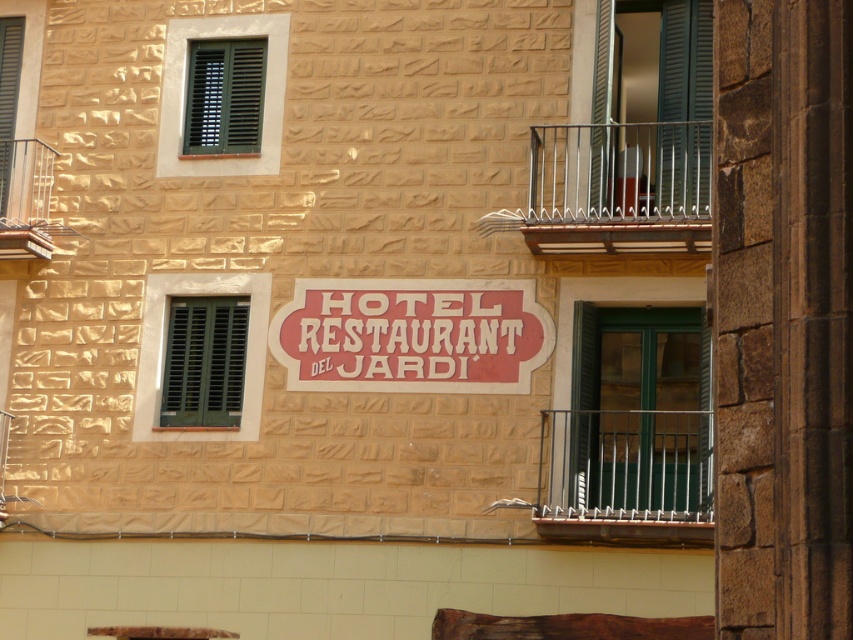
You are standing at a point 101.82 feet away from the point marked at coordinates (682, 129) on the building facade. If you want to take a photo of the rectangular sign with rounded corners that says HOTEL RESTAURANT DEL JARDI, will you be able to capture the entire sign in your shot without moving closer?

The point marked at coordinates (682, 129) is 101.82 feet away from you. Since the rectangular sign with rounded corners is located on the same building facade, its distance from you would also be approximately 101.82 feet. Whether you can capture the entire sign depends on your camera lens and field of view, but the distance alone does not guarantee it. However, based on typical camera capabilities, at this distance, it might be possible to frame the sign properly without moving closer, assuming the sign

You are an interior designer planning to install a new window covering. You have two options from the image available to choose from. Which of the two options, the green matte shutters at upper right or the green matte shutter at left, is wider?

The green matte shutters at upper right is wider than the green matte shutter at left.

You are standing in front of the building and want to know which green matte shutter is wider. Can you tell me which one is wider between the green matte shutter at upper left and the green matte shutter at left?

The green matte shutter at upper left is wider than the green matte shutter at left.